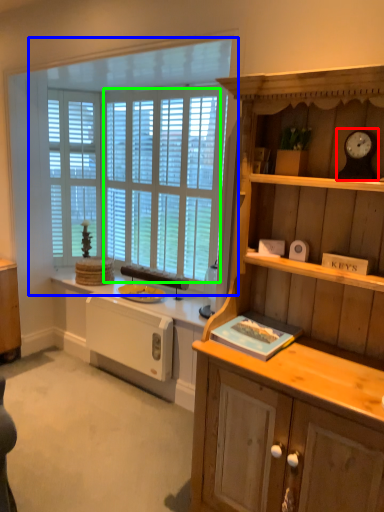
Question: Which object is the farthest from clock (highlighted by a red box)? Choose among these: window (highlighted by a blue box) or window screen (highlighted by a green box).

Choices:
 (A) window
 (B) window screen

Answer: (B)